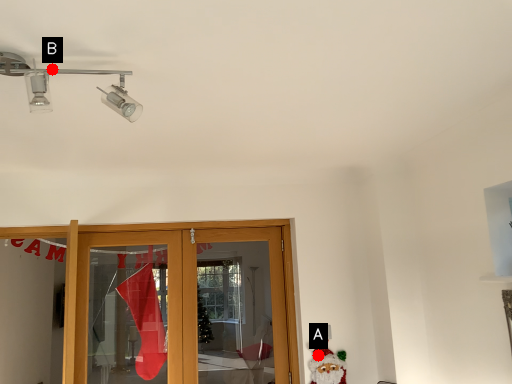
Question: Two points are circled on the image, labeled by A and B beside each circle. Which point is closer to the camera?

Choices:
 (A) A is closer
 (B) B is closer

Answer: (B)